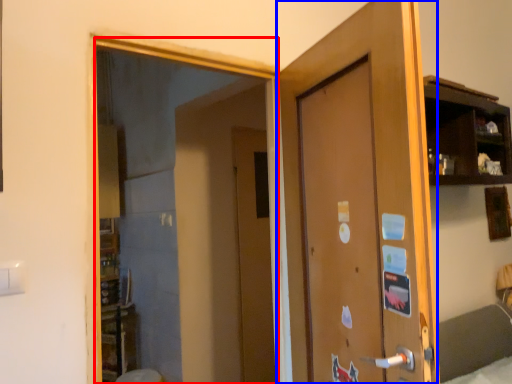
Question: Among these objects, which one is nearest to the camera, mirror (highlighted by a red box) or door (highlighted by a blue box)?

Choices:
 (A) mirror
 (B) door

Answer: (B)